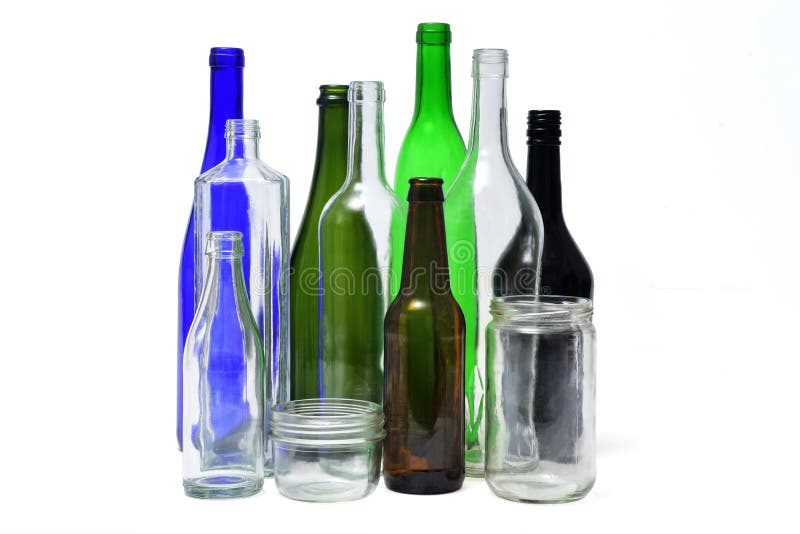
Where is `clear containers`? This screenshot has width=800, height=534. clear containers is located at coordinates point(230,359), point(234,191), point(362,219), point(492,207), point(542,389), point(322,453).